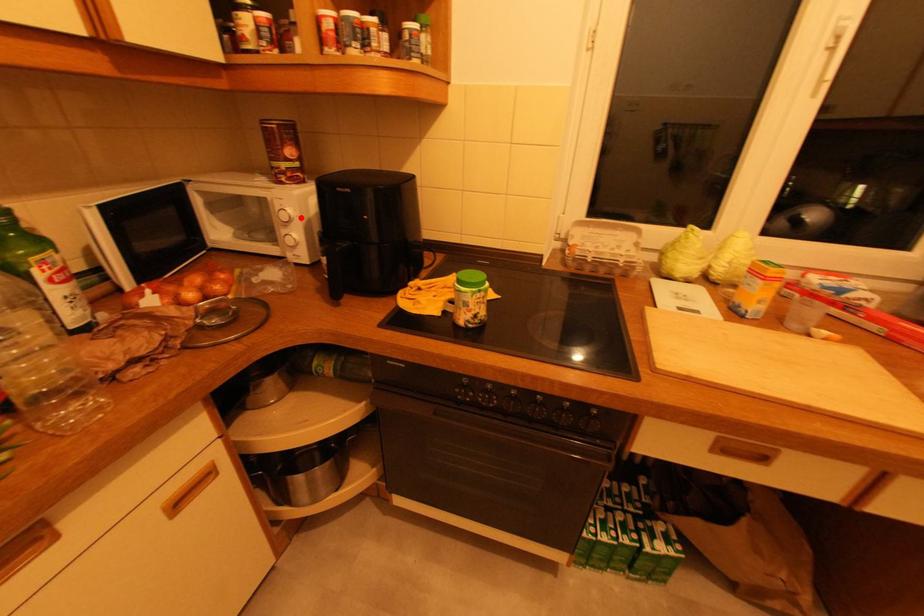
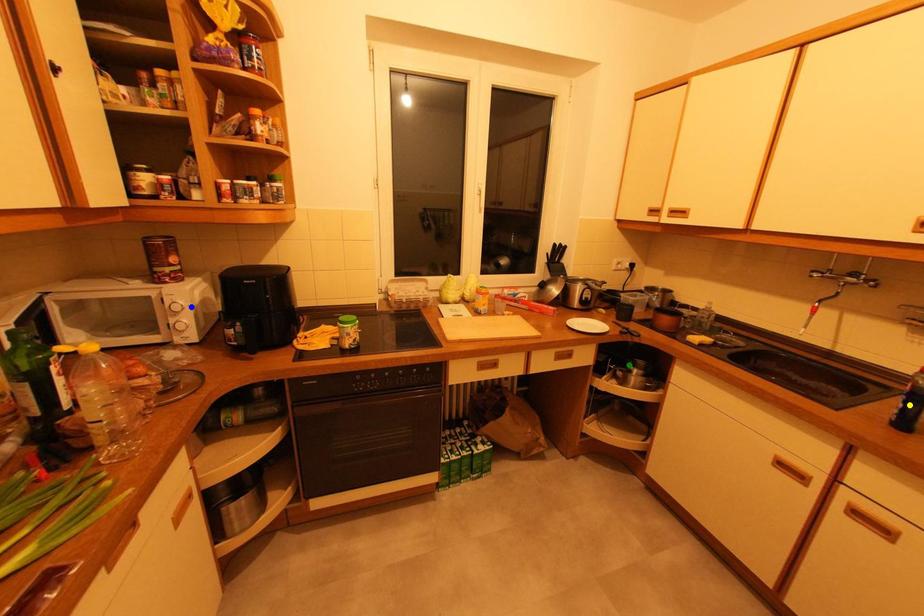
Question: I am providing you with two images of the same scene from different viewpoints. A red point is marked on the first image. You are given multiple points on the second image. Which point in image 2 is actually the same real-world point as the red point in image 1?

Choices:
 (A) green point
 (B) blue point
 (C) yellow point

Answer: (B)